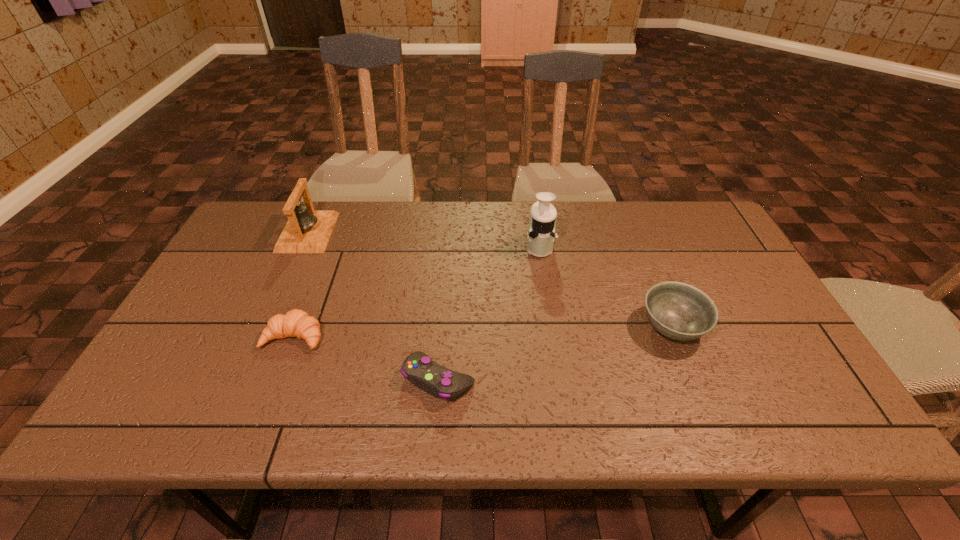
Where is `free space located on the front of the crescent roll`? free space located on the front of the crescent roll is located at coordinates point(266,410).

Find the location of a particular element. This screenshot has width=960, height=540. vacant space situated 0.290m on the back of the control is located at coordinates (447, 271).

The height and width of the screenshot is (540, 960). What are the coordinates of `juicer situated at the far edge` in the screenshot? It's located at (541, 231).

This screenshot has width=960, height=540. I want to click on bell that is positioned at the far edge, so click(307, 230).

This screenshot has width=960, height=540. What are the coordinates of `object that is at the near edge` in the screenshot? It's located at (434, 379).

Where is `object located in the left edge section of the desktop`? The height and width of the screenshot is (540, 960). object located in the left edge section of the desktop is located at coordinates (307, 230).

Find the location of a particular element. The image size is (960, 540). object located in the far left corner section of the desktop is located at coordinates (307, 230).

Find the location of a particular element. Image resolution: width=960 pixels, height=540 pixels. vacant space at the far edge of the desktop is located at coordinates (467, 213).

Where is `vacant space at the near edge of the desktop`? This screenshot has height=540, width=960. vacant space at the near edge of the desktop is located at coordinates (412, 415).

Where is `free location at the right edge of the desktop`? The height and width of the screenshot is (540, 960). free location at the right edge of the desktop is located at coordinates (756, 305).